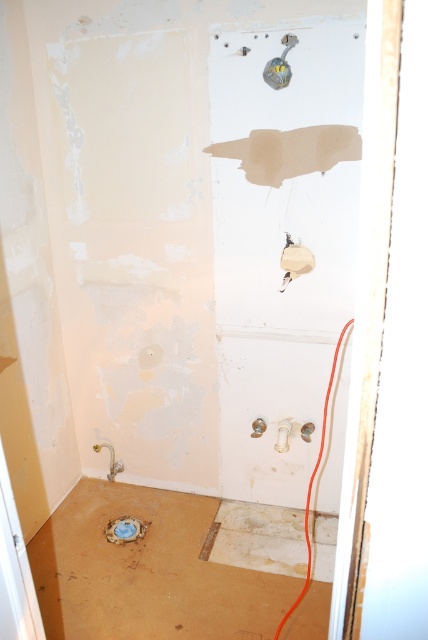
Is matte white outlet at center in front of matte plastic drain at lower center?

Yes, it is.

Is point (309, 260) closer to viewer compared to point (136, 531)?

Yes, it is in front of point (136, 531).

Identify the location of matte white outlet at center. (294, 260).